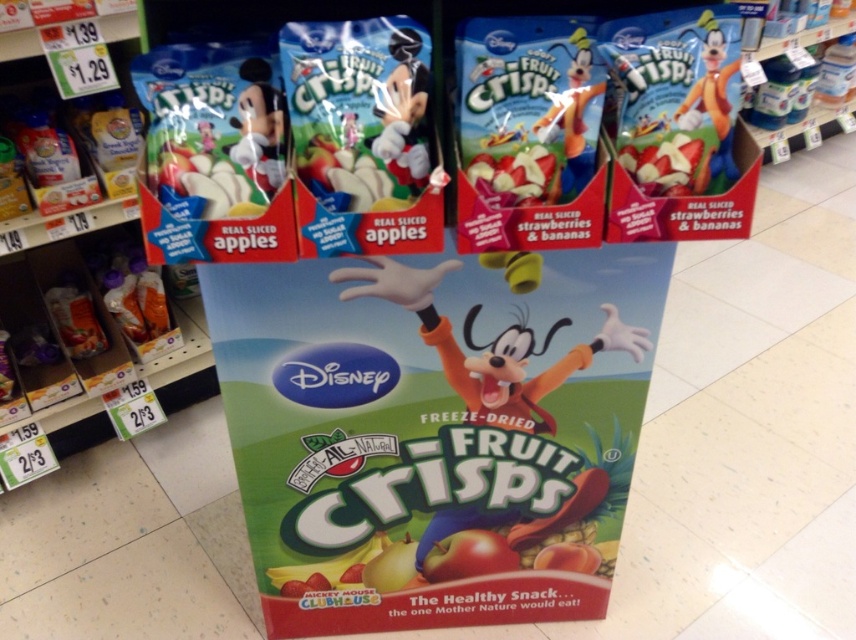
You are a store employee arranging the display stand for Disney Fruit Crisps. You need to place a new white matte plush toy at center. Where should you place it?

The white matte plush toy at center should be placed at point (403,113).

You are a customer at the store looking at the display stand for Fruit Crisps. You see the orange fabric goofy at center and the matte yellow plush toy at upper right. Which object is closer to the bottom of the display stand?

The orange fabric goofy at center is positioned under the matte yellow plush toy at upper right, so it is closer to the bottom of the display stand.

You are standing in front of the Disney Fruit Crisps display stand and notice two points marked on the stand. The first point is at coordinate point (257,150), and the second is at coordinate point (721,125). Which point is closer to you?

The point at coordinate (257,150) is closer to you than the point at (721,125).